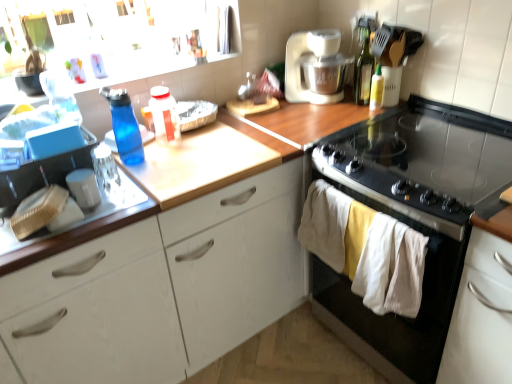
Where is `vacant space in front of yellow matte bottle at upper right, the 1th bottle in the right-to-left sequence`? The height and width of the screenshot is (384, 512). vacant space in front of yellow matte bottle at upper right, the 1th bottle in the right-to-left sequence is located at coordinates (x=366, y=119).